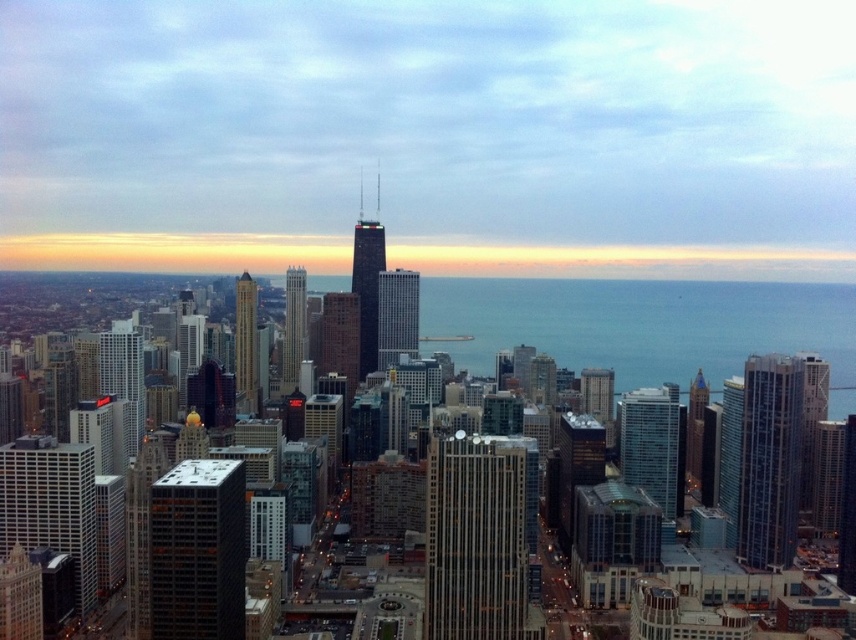
You are standing at the center of the city and looking towards the tallest building. Which direction should you turn to see the glassy steel skyscraper at right?

The glassy steel skyscraper at right is located at coordinates point (770,460), so you should turn to your right to see it since it is positioned to the right side of the view.

You are standing at the base of the tallest building in the city and looking out at the skyline. There are two points marked on the horizon, one at coordinates point (438,493) and another at point (381,284). Which of these points is closer to you?

Point (381,284) is closer to you because it is in front of point (438,493) according to their spatial relationship.